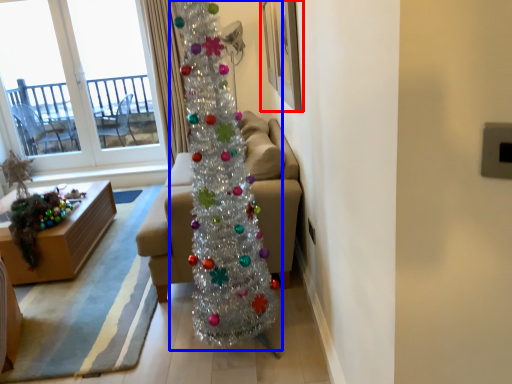
Question: Which object is closer to the camera taking this photo, picture frame (highlighted by a red box) or christmas tree (highlighted by a blue box)?

Choices:
 (A) picture frame
 (B) christmas tree

Answer: (B)